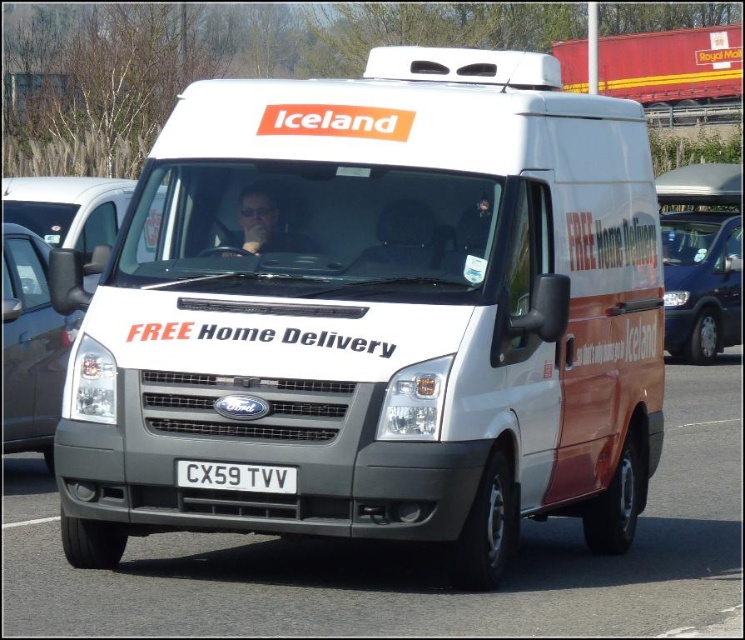
This screenshot has width=745, height=640. Describe the element at coordinates (31, 346) in the screenshot. I see `satin black van at left` at that location.

The width and height of the screenshot is (745, 640). What do you see at coordinates (31, 346) in the screenshot?
I see `satin black van at left` at bounding box center [31, 346].

Find the location of `satin black van at left`. satin black van at left is located at coordinates (31, 346).

Is the position of white matte van at center less distant than that of metallic blue van at right?

That is True.

Locate an element on the screen. Image resolution: width=745 pixels, height=640 pixels. white matte van at center is located at coordinates (377, 314).

This screenshot has width=745, height=640. What are the coordinates of `white matte van at center` in the screenshot? It's located at coord(377,314).

Who is more forward, (44, 406) or (228, 480)?

Point (228, 480) is more forward.

Who is more distant from viewer, (57, 397) or (212, 468)?

Point (57, 397)

Is point (44, 408) positioned before point (215, 476)?

No, (44, 408) is further to viewer.

The image size is (745, 640). Identify the location of satin black van at left. (31, 346).